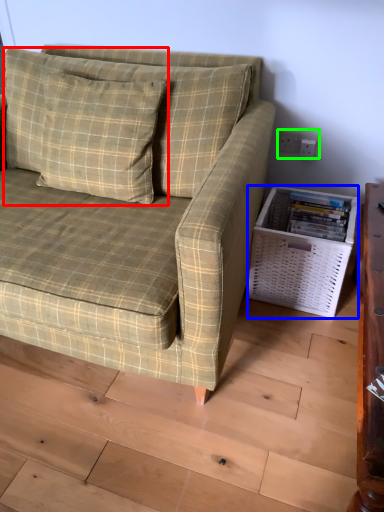
Question: Considering the real-world distances, which object is farthest from pillow (highlighted by a red box)? basket (highlighted by a blue box) or electric outlet (highlighted by a green box)?

Choices:
 (A) basket
 (B) electric outlet

Answer: (B)